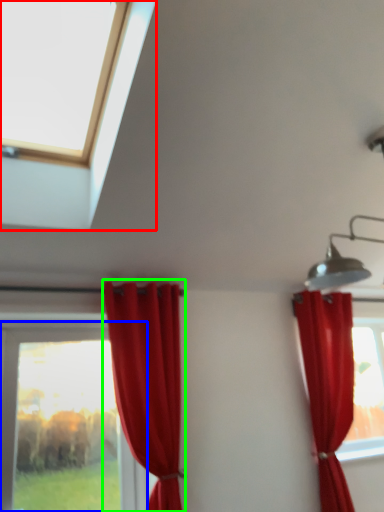
Question: Considering the real-world distances, which object is closest to window (highlighted by a red box)? window (highlighted by a blue box) or curtain (highlighted by a green box).

Choices:
 (A) window
 (B) curtain

Answer: (B)